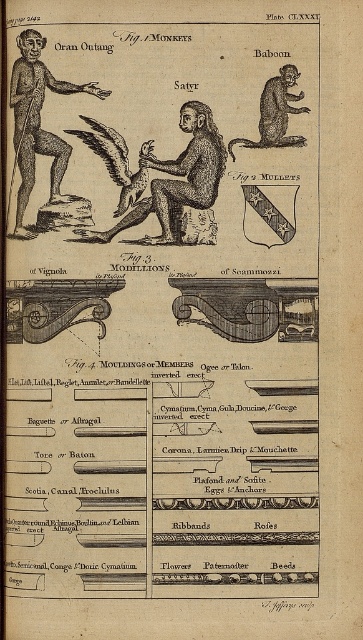
What are the coordinates of the brown textured figure at center?

The brown textured figure at center is located at coordinates (173,173).